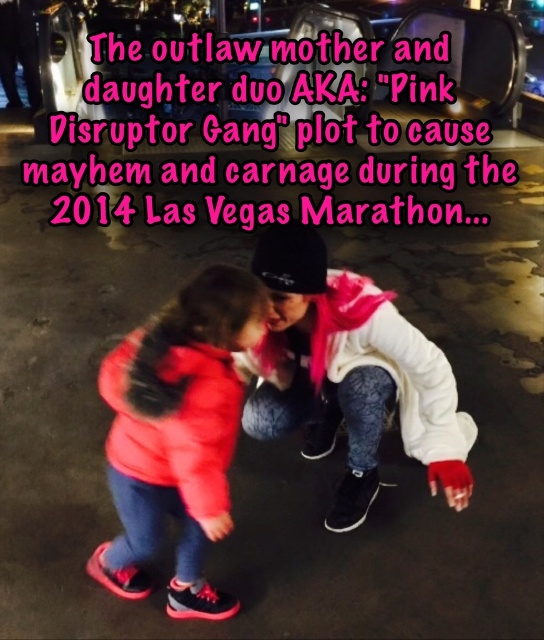
Question: Can you confirm if white matte jacket at center is positioned below matte red jacket at lower left?

Choices:
 (A) no
 (B) yes

Answer: (A)

Question: Is white matte jacket at center bigger than matte red jacket at lower left?

Choices:
 (A) no
 (B) yes

Answer: (A)

Question: Among these objects, which one is farthest from the camera?

Choices:
 (A) matte red jacket at lower left
 (B) white matte jacket at center

Answer: (B)

Question: Is white matte jacket at center closer to camera compared to matte red jacket at lower left?

Choices:
 (A) yes
 (B) no

Answer: (B)

Question: Which of the following is the farthest from the observer?

Choices:
 (A) matte red jacket at lower left
 (B) white matte jacket at center

Answer: (B)